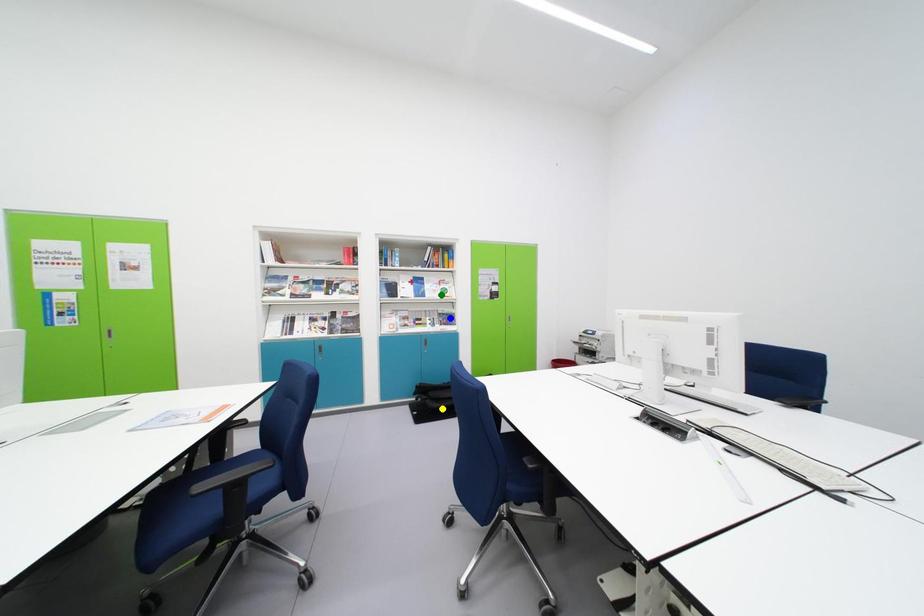
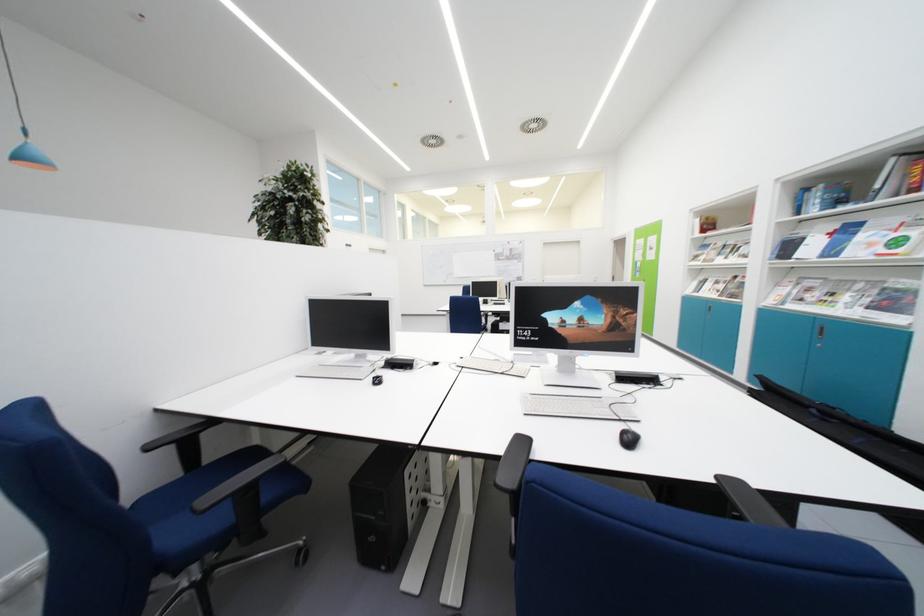
I am providing you with two images of the same scene from different viewpoints. Three points are marked in image1. Which point corresponds to a part or object that is occluded in image2?In image1, three points are marked. Which of them correspond to a part or object that is occluded in image2?Among the three points shown in image1, which one corresponds to a part or object that is no longer visible due to occlusion in image2?

Invisible in image2: yellow point.